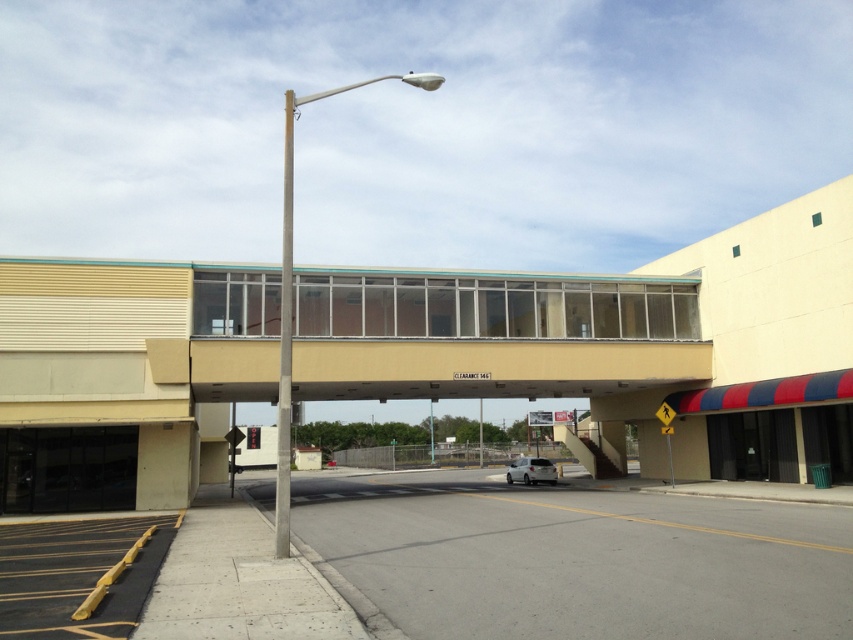
Question: Is gray concrete pole at center below white matte car at center?

Choices:
 (A) yes
 (B) no

Answer: (B)

Question: Which object appears closest to the camera in this image?

Choices:
 (A) silver metallic pole at center
 (B) white matte car at center
 (C) beige matte overpass at center
 (D) gray concrete pole at center

Answer: (D)

Question: Can you confirm if gray concrete pole at center is smaller than white matte car at center?

Choices:
 (A) no
 (B) yes

Answer: (A)

Question: Which object appears farthest from the camera in this image?

Choices:
 (A) beige matte overpass at center
 (B) gray concrete pole at center
 (C) white matte car at center
 (D) silver metallic pole at center

Answer: (C)

Question: Which of the following is the closest to the observer?

Choices:
 (A) silver metallic pole at center
 (B) white matte car at center

Answer: (A)

Question: Is beige matte overpass at center thinner than white matte car at center?

Choices:
 (A) no
 (B) yes

Answer: (A)